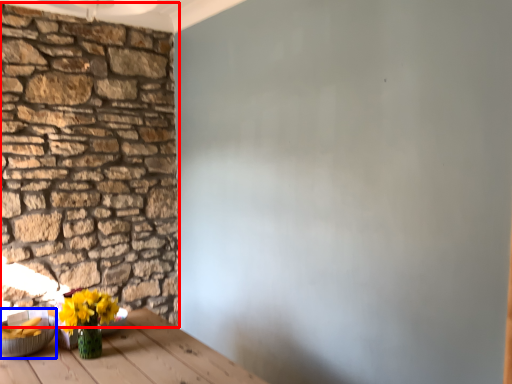
Question: Which object appears closest to the camera in this image, brick (highlighted by a red box) or bowl (highlighted by a blue box)?

Choices:
 (A) brick
 (B) bowl

Answer: (B)